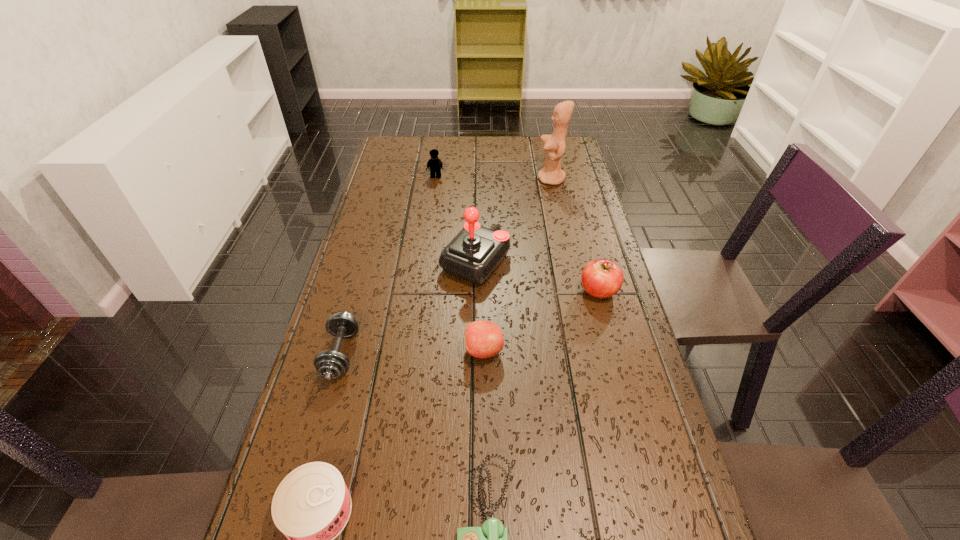
I want to click on vacant space at the left edge, so click(x=354, y=265).

Where is `free location at the right edge`? This screenshot has width=960, height=540. free location at the right edge is located at coordinates (580, 349).

Where is `vacant space at the far left corner of the desktop`? vacant space at the far left corner of the desktop is located at coordinates (392, 139).

Image resolution: width=960 pixels, height=540 pixels. Identify the location of vacant space that is in between the Lego and the right apple. (517, 234).

The image size is (960, 540). In order to click on free space between the dumbbell and the Lego in this screenshot , I will do `click(389, 266)`.

Where is `empty location between the dumbbell and the joystick`? Image resolution: width=960 pixels, height=540 pixels. empty location between the dumbbell and the joystick is located at coordinates (408, 307).

This screenshot has width=960, height=540. I want to click on free area in between the second tallest object and the figurine, so click(x=514, y=219).

Find the location of `object that is the sixth closest one to the right apple`. object that is the sixth closest one to the right apple is located at coordinates (434, 163).

The width and height of the screenshot is (960, 540). Identify the location of object that can be found as the fourth closest to the shorter apple. (329, 364).

Find the location of a particular element. vacant space that satisfies the following two spatial constraints: 1. on the front-facing side of the figurine; 2. on the front side of the seventh shortest object is located at coordinates (569, 260).